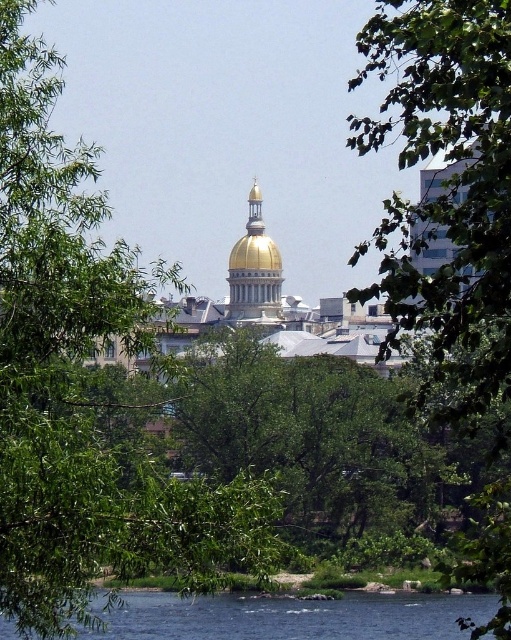
You are a photographer trying to capture the golden dome structure in the background. You notice two trees, the green leafy tree at left and the green leafy tree at center. Which tree is blocking your view more when standing in front of the scene?

The green leafy tree at center is behind the green leafy tree at left, so the green leafy tree at left is closer to you and thus blocks your view more.

You are standing in front of the golden dome structure and want to move from point (78, 144) to point (504, 240). Which point is closer to you initially?

Point (78, 144) is closer to you initially because it is further to the viewer than point (504, 240).

You are standing in front of the golden dome structure and want to take a photo without the green leafy tree at left blocking the view. Where should you move to ensure the tree is out of frame?

Move to the right side of the current position since the green leafy tree at left is located at point (83,385), which is on the left side. By moving right, you can position yourself away from the tree and capture the dome without obstruction.